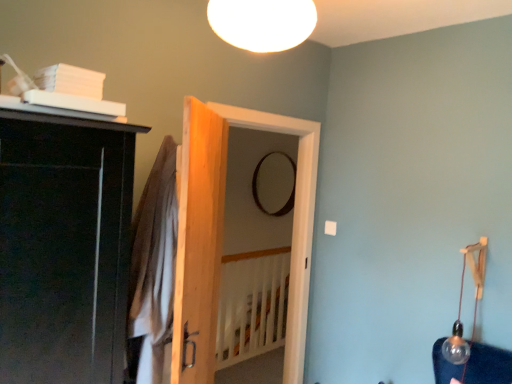
Question: Is clear glass bulb at right, arranged as the first lamp when viewed from the right, taller or shorter than brown cotton robe at center?

Choices:
 (A) short
 (B) tall

Answer: (A)

Question: In terms of size, does clear glass bulb at right, arranged as the first lamp when viewed from the right, appear bigger or smaller than brown cotton robe at center?

Choices:
 (A) big
 (B) small

Answer: (B)

Question: Estimate the real-world distances between objects in this image. Which object is farther from the white wooden bed frame at center?

Choices:
 (A) wooden door at center, positioned as the first door in back-to-front order
 (B) clear glass bulb at right, the second lamp viewed from the front
 (C) black matte mirror at center
 (D) brown cotton robe at center
 (E) natural wood door at center, placed as the 1th door when sorted from front to back

Answer: (D)

Question: Which object is the closest to the black matte mirror at center?

Choices:
 (A) brown cotton robe at center
 (B) white matte ceiling light at upper center, the first lamp viewed from the top
 (C) white wooden bed frame at center
 (D) wooden door at center, which appears as the second door when viewed from the front
 (E) clear glass bulb at right, acting as the first lamp starting from the back

Answer: (C)